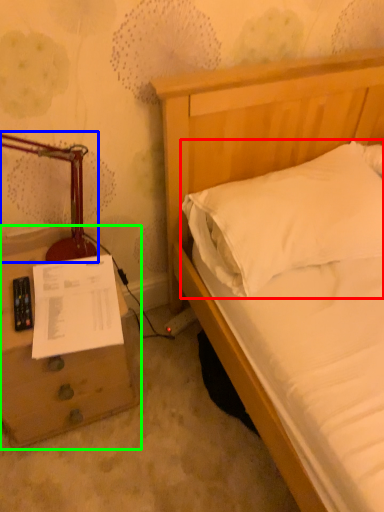
Question: Which object is the farthest from pillow (highlighted by a red box)? Choose among these: table lamp (highlighted by a blue box) or nightstand (highlighted by a green box).

Choices:
 (A) table lamp
 (B) nightstand

Answer: (B)